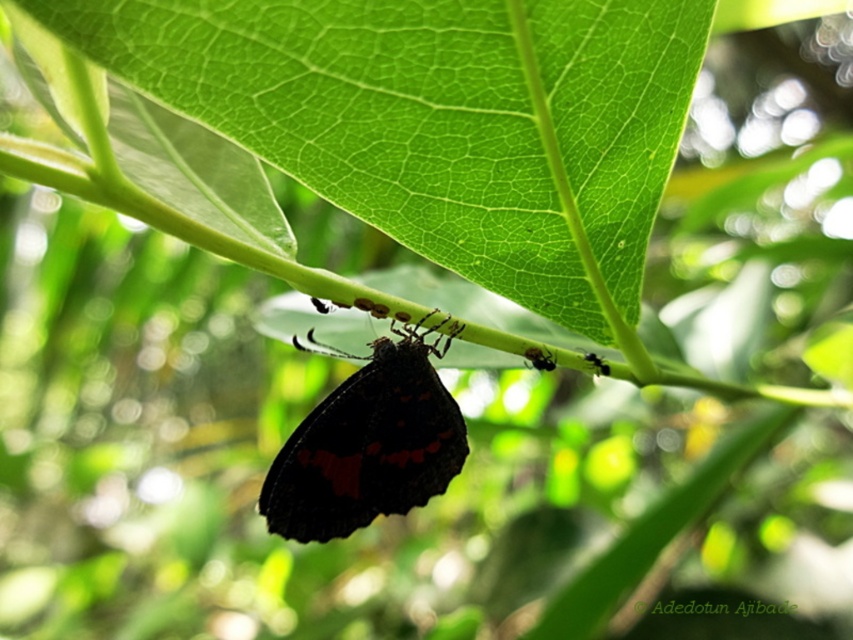
You are a gardener observing the leafy green plant. You notice the green matte leaf at center and the dark matte butterfly at center. Which object is positioned higher in the image?

The green matte leaf at center is positioned above the dark matte butterfly at center in the image.